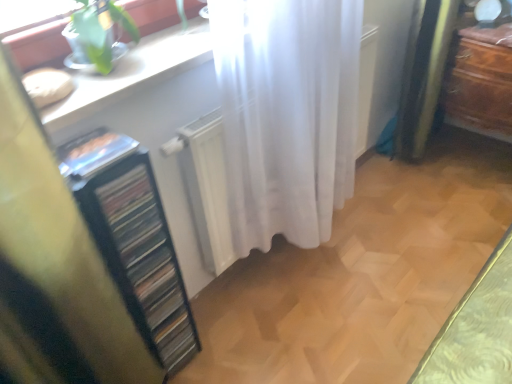
I want to click on free space above white glossy counter top at upper left (from a real-world perspective), so click(x=148, y=54).